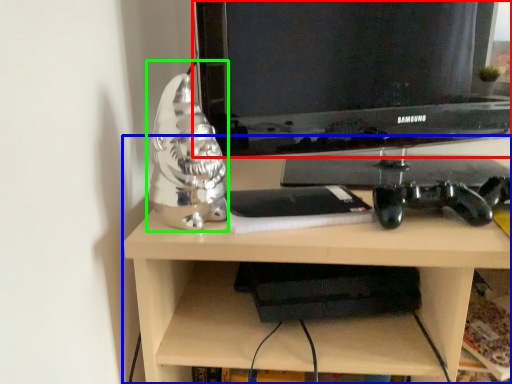
Question: Which object is the closest to the television (highlighted by a red box)? Choose among these: desk (highlighted by a blue box) or figurine (highlighted by a green box).

Choices:
 (A) desk
 (B) figurine

Answer: (A)